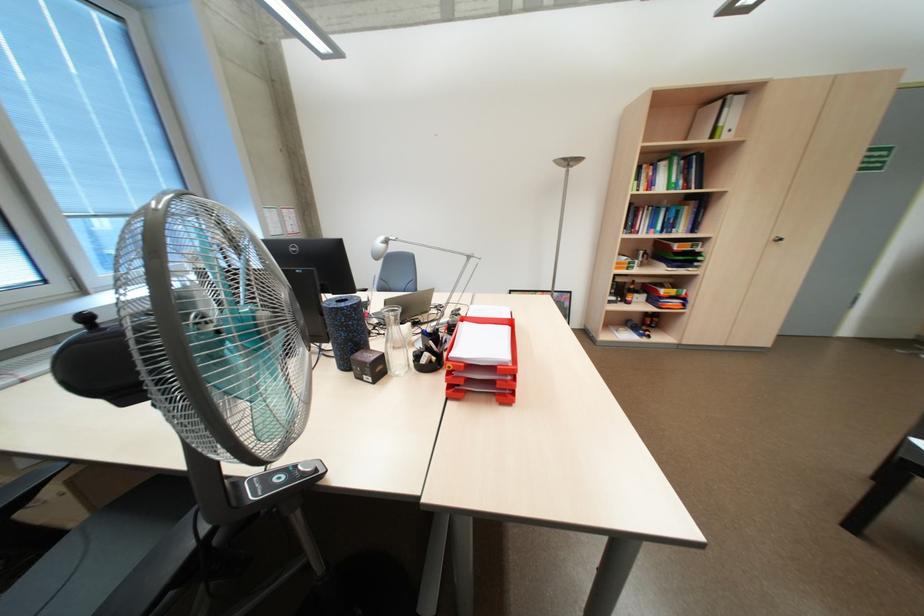
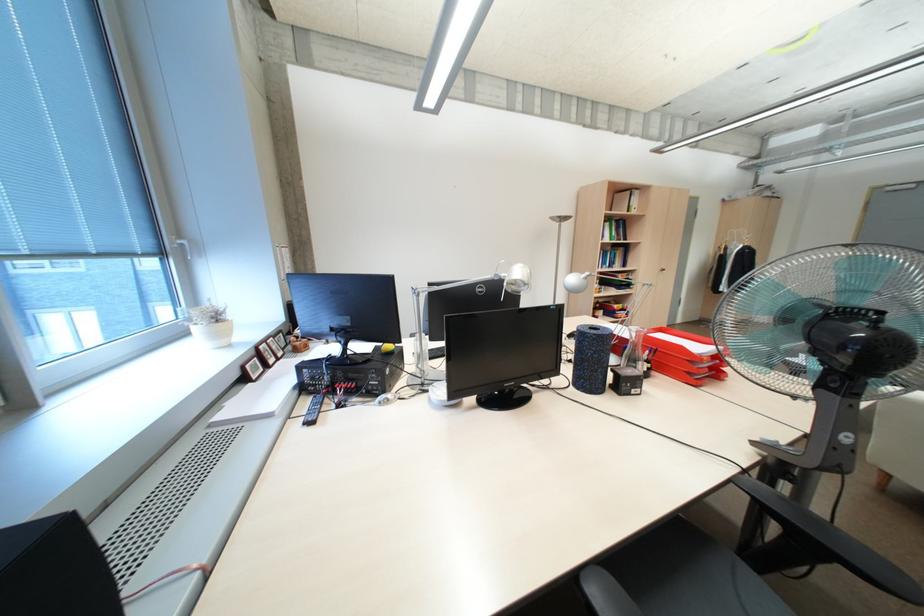
Question: I am providing you with two images of the same scene from different viewpoints. Please identify which objects are invisible in image2.

Choices:
 (A) pen in holder
 (B) blue foam roller
 (C) white bench sitting surface
 (D) white flower pot

Answer: (A)